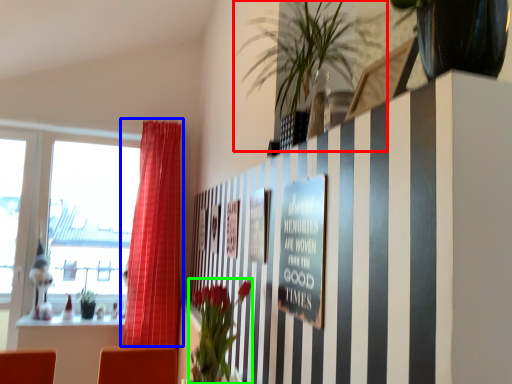
Question: Based on their relative distances, which object is farther from houseplant (highlighted by a red box)? Choose from curtain (highlighted by a blue box) and floral arrangement (highlighted by a green box).

Choices:
 (A) curtain
 (B) floral arrangement

Answer: (A)